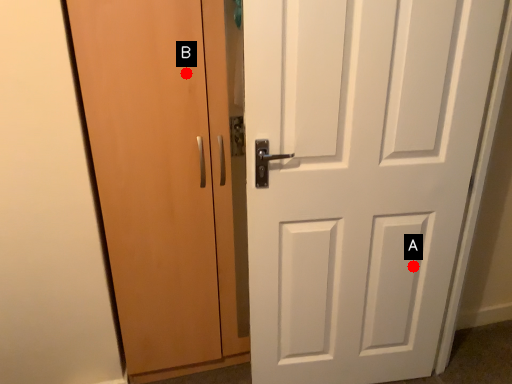
Question: Two points are circled on the image, labeled by A and B beside each circle. Which point is further to the camera?

Choices:
 (A) A is further
 (B) B is further

Answer: (A)